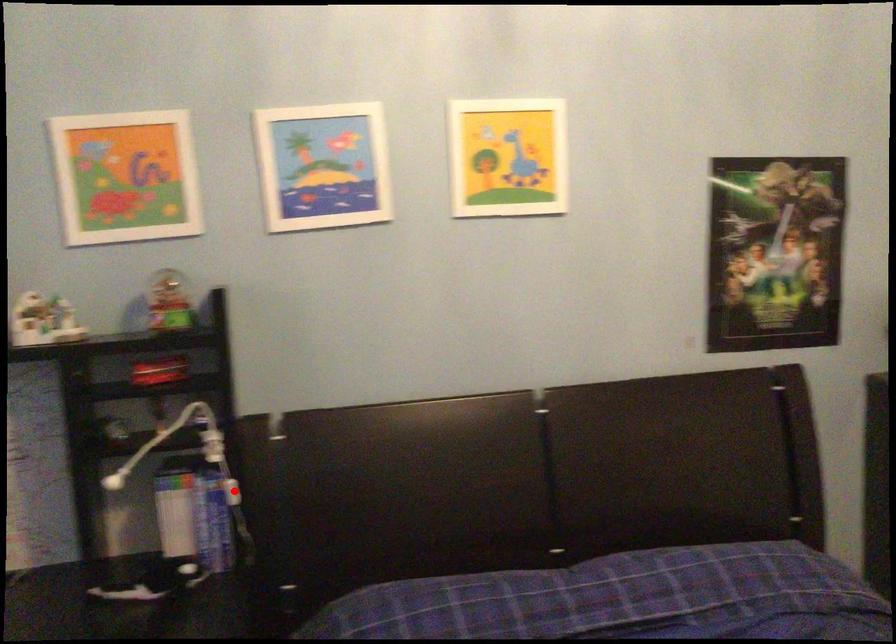
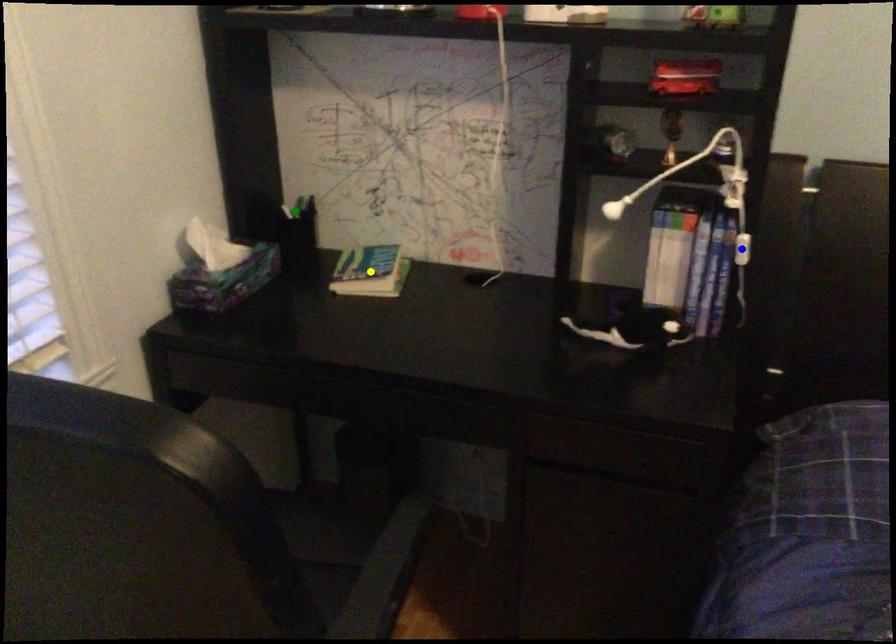
Question: I am providing you with two images of the same scene from different viewpoints. A red point is marked on the first image. You are given multiple points on the second image. Which point in image 2 represents the same 3d spot as the red point in image 1?

Choices:
 (A) blue point
 (B) yellow point
 (C) green point

Answer: (A)